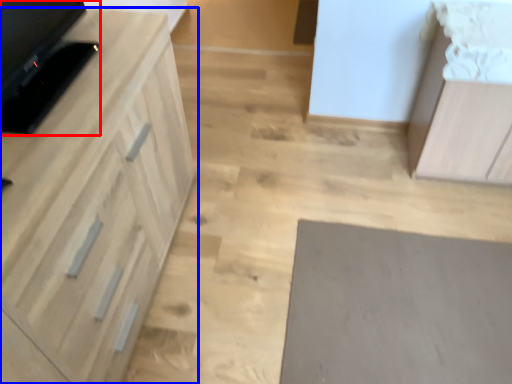
Question: Which of the following is the closest to the observer, appliance (highlighted by a red box) or cabinetry (highlighted by a blue box)?

Choices:
 (A) appliance
 (B) cabinetry

Answer: (B)